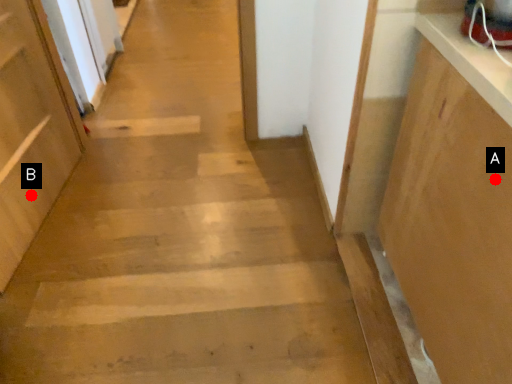
Question: Two points are circled on the image, labeled by A and B beside each circle. Among these points, which one is farthest from the camera?

Choices:
 (A) A is further
 (B) B is further

Answer: (B)